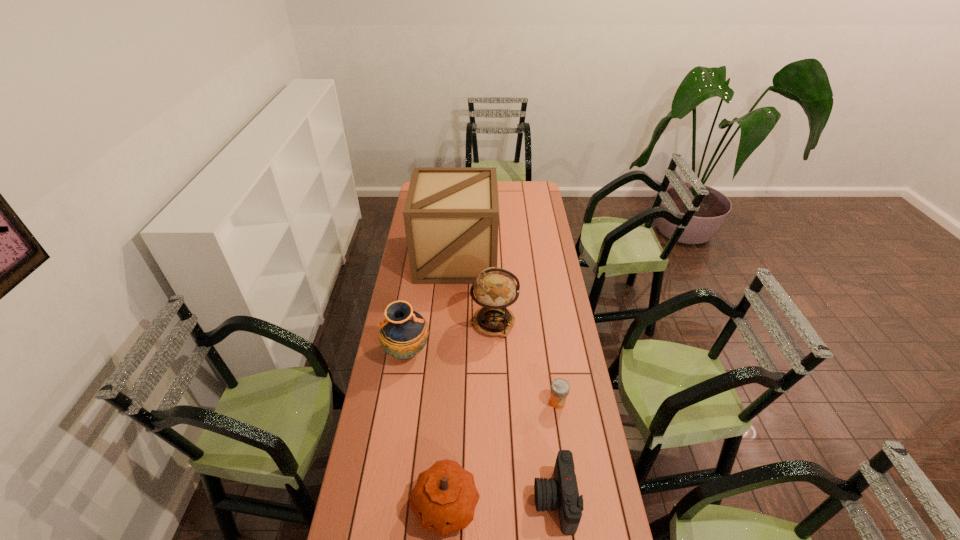
You are a GUI agent. You are given a task and a screenshot of the screen. Output one action in this format:
    pyautogui.click(x=<x>, y=<y>)
    Task: Click on the vacant space located 0.100m at the center of the globe
    
    Given the screenshot: What is the action you would take?
    pyautogui.click(x=446, y=323)

You are a GUI agent. You are given a task and a screenshot of the screen. Output one action in this format:
    pyautogui.click(x=<x>, y=<y>)
    Task: Click on the free point located 0.060m on the back of the pottery
    This screenshot has width=960, height=540.
    Given the screenshot: What is the action you would take?
    pyautogui.click(x=411, y=323)

At what (x,y) coordinates should I click in order to perform the action: click on blank area located at the lens of the fifth tallest object. Please return your answer as a coordinate pair (x, y). The width and height of the screenshot is (960, 540). Looking at the image, I should click on (432, 500).

Locate an element on the screen. The height and width of the screenshot is (540, 960). blank space located 0.280m at the lens of the fifth tallest object is located at coordinates (444, 500).

Identify the location of vacant space located at the lens of the fifth tallest object. (416, 500).

Identify the location of vacant space located 0.140m on the label side of the shortest object. This screenshot has height=540, width=960. (564, 446).

Where is `box that is at the left edge`? box that is at the left edge is located at coordinates (451, 214).

This screenshot has height=540, width=960. What are the coordinates of `pottery that is at the left edge` in the screenshot? It's located at (403, 334).

Identify the location of camera that is at the right edge. (560, 493).

Where is `medicine situated at the right edge`? medicine situated at the right edge is located at coordinates (560, 388).